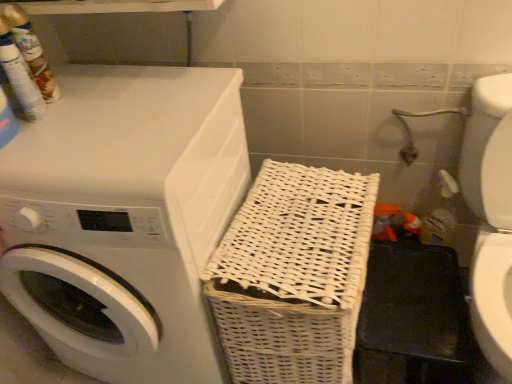
Question: Is white glossy washer at lower right shorter than white wicker basket at center?

Choices:
 (A) no
 (B) yes

Answer: (A)

Question: From a real-world perspective, is white glossy washer at lower right beneath white wicker basket at center?

Choices:
 (A) no
 (B) yes

Answer: (A)

Question: Would you say white glossy washer at lower right is a long distance from white wicker basket at center?

Choices:
 (A) yes
 (B) no

Answer: (B)

Question: Does white glossy washer at lower right appear on the left side of white wicker basket at center?

Choices:
 (A) no
 (B) yes

Answer: (A)

Question: From the image's perspective, does white glossy washer at lower right appear higher than white wicker basket at center?

Choices:
 (A) yes
 (B) no

Answer: (A)

Question: From a real-world perspective, is white matte/woven laundry basket at right above or below white wicker basket at center?

Choices:
 (A) below
 (B) above

Answer: (B)

Question: In the image, is white matte/woven laundry basket at right positioned in front of or behind white wicker basket at center?

Choices:
 (A) front
 (B) behind

Answer: (A)

Question: In terms of width, does white matte/woven laundry basket at right look wider or thinner when compared to white wicker basket at center?

Choices:
 (A) wide
 (B) thin

Answer: (A)

Question: Considering the positions of white matte/woven laundry basket at right and white wicker basket at center in the image, is white matte/woven laundry basket at right bigger or smaller than white wicker basket at center?

Choices:
 (A) big
 (B) small

Answer: (A)

Question: Considering the positions of white wicker basket at center and white glossy washer at lower right in the image, is white wicker basket at center taller or shorter than white glossy washer at lower right?

Choices:
 (A) short
 (B) tall

Answer: (A)

Question: Is white wicker basket at center spatially inside white glossy washer at lower right, or outside of it?

Choices:
 (A) inside
 (B) outside

Answer: (B)

Question: Visually, is white wicker basket at center positioned to the left or to the right of white glossy washer at lower right?

Choices:
 (A) right
 (B) left

Answer: (B)

Question: From the image's perspective, is white wicker basket at center located above or below white glossy washer at lower right?

Choices:
 (A) above
 (B) below

Answer: (B)

Question: Is white glossy washer at lower right situated inside white matte/woven laundry basket at right or outside?

Choices:
 (A) outside
 (B) inside

Answer: (A)

Question: Does point (497, 165) appear closer or farther from the camera than point (143, 261)?

Choices:
 (A) closer
 (B) farther

Answer: (B)